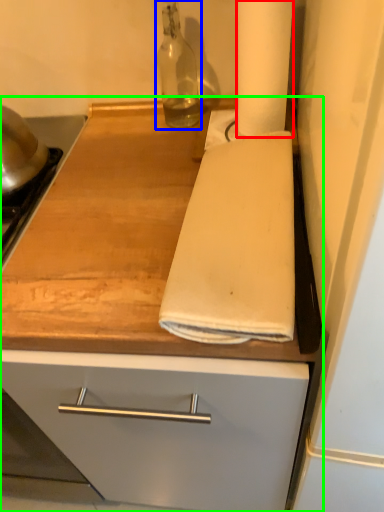
Question: Based on their relative distances, which object is farther from paper towel (highlighted by a red box)? Choose from bottle (highlighted by a blue box) and countertop (highlighted by a green box).

Choices:
 (A) bottle
 (B) countertop

Answer: (B)